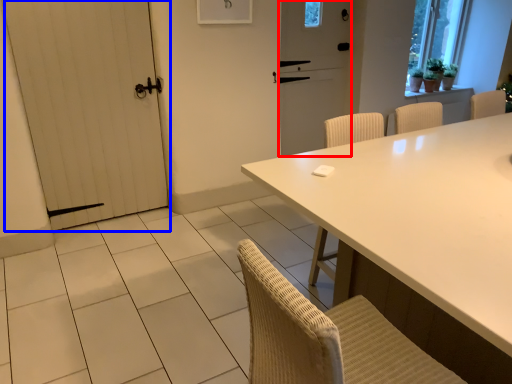
Question: Which object appears farthest to the camera in this image, screen door (highlighted by a red box) or door (highlighted by a blue box)?

Choices:
 (A) screen door
 (B) door

Answer: (A)